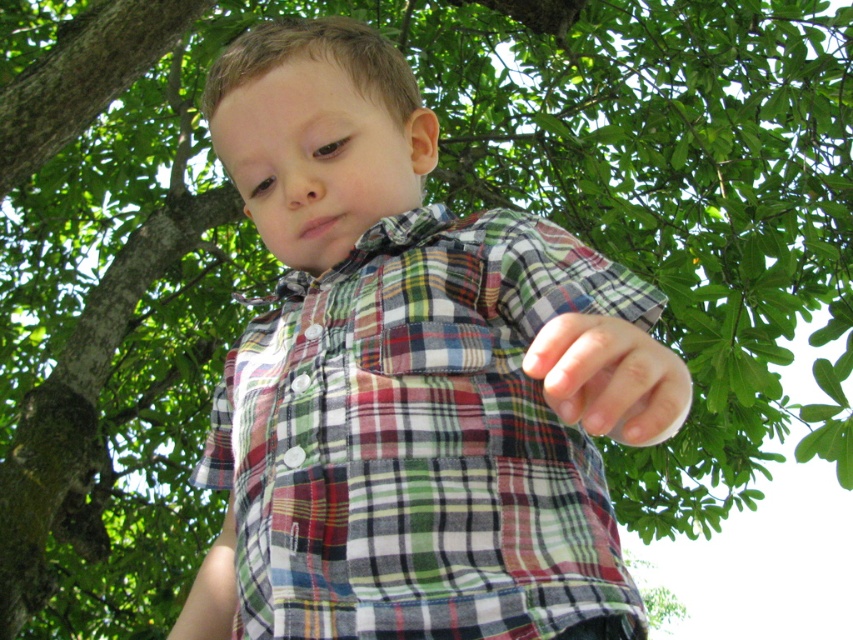
In the scene shown: You are a photographer trying to capture the matte plaid shirt at center and the green rough bark at upper left in the same frame. Based on their positions, which object should you adjust your camera to focus on first if you want to include both in your shot?

The green rough bark at upper left is to the left of matte plaid shirt at center, so you should focus on the green rough bark at upper left first to ensure both objects are included in the frame.

You are a painter standing in front of the tree and want to paint the green rough bark at upper left and the matte plaid shirt at center. Which object should you focus on first if you want to paint the taller one first?

The green rough bark at upper left is much taller than the matte plaid shirt at center, so you should focus on painting the green rough bark at upper left first.